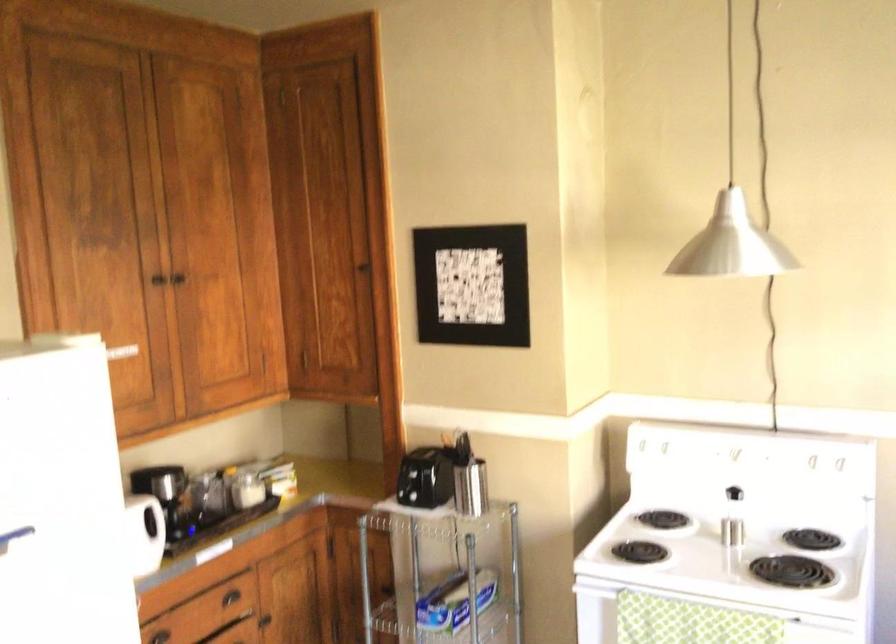
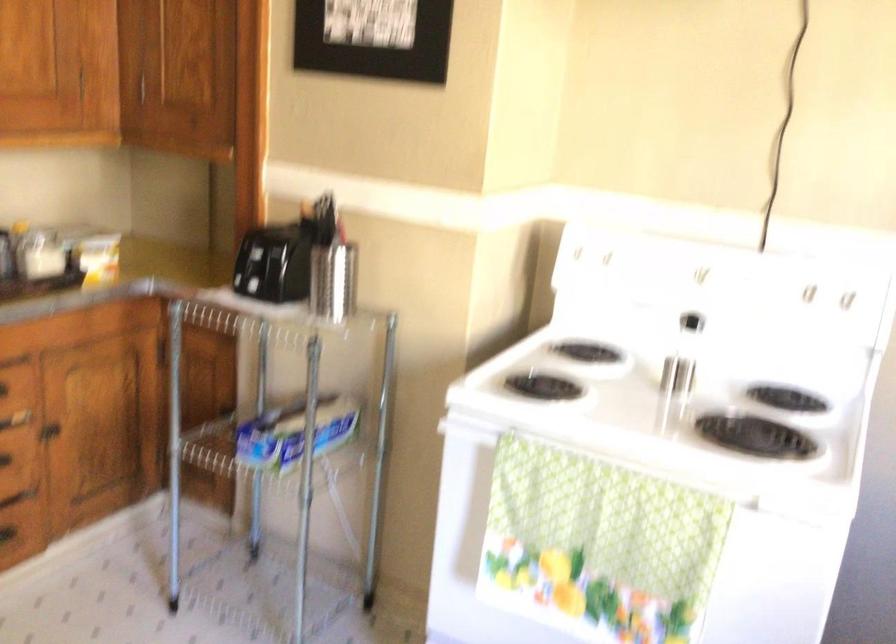
Where in the second image is the point corresponding to pixel 812 458 from the first image?

(805, 292)